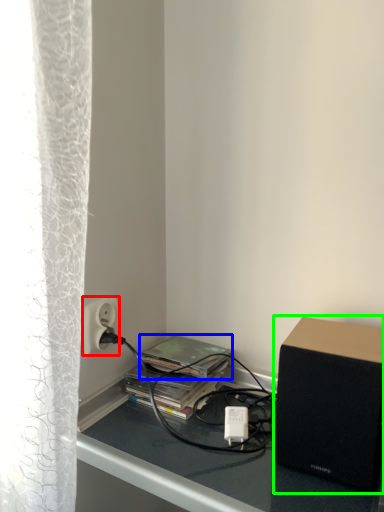
Question: Considering the real-world distances, which object is closest to power outlet (highlighted by a red box)? paperback book (highlighted by a blue box) or loudspeaker (highlighted by a green box).

Choices:
 (A) paperback book
 (B) loudspeaker

Answer: (A)